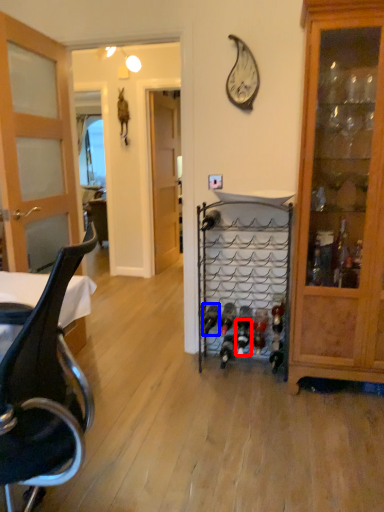
Question: Among these objects, which one is nearest to the camera, wine bottle (highlighted by a red box) or wine bottle (highlighted by a blue box)?

Choices:
 (A) wine bottle
 (B) wine bottle

Answer: (A)